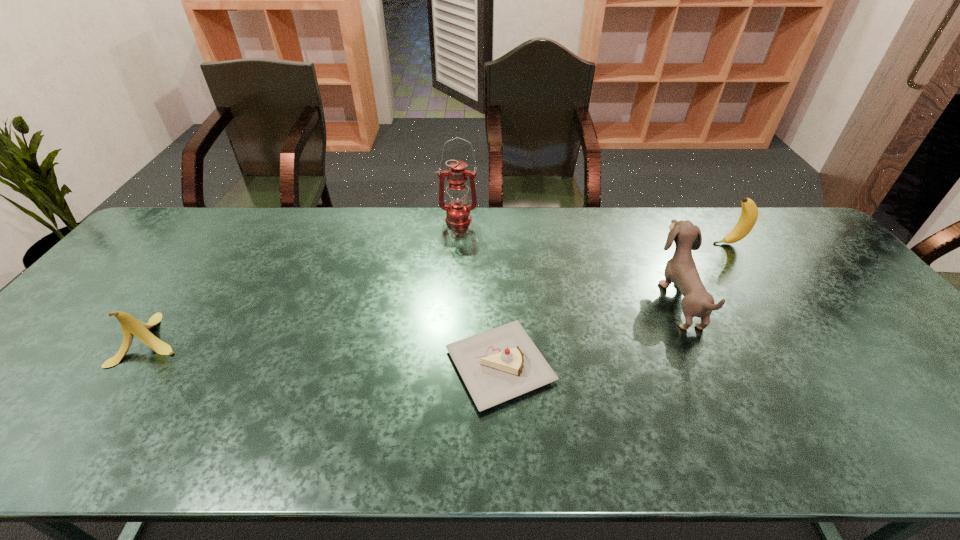
The width and height of the screenshot is (960, 540). I want to click on the farthest object, so click(458, 213).

I want to click on oil lamp, so click(458, 213).

In order to click on the fourth object from left to right in this screenshot , I will do `click(681, 269)`.

Find the location of a particular element. The height and width of the screenshot is (540, 960). the second farthest object is located at coordinates (749, 214).

This screenshot has height=540, width=960. I want to click on the taller banana, so click(749, 214).

Identify the location of the left banana. This screenshot has height=540, width=960. (130, 325).

Image resolution: width=960 pixels, height=540 pixels. I want to click on the second shortest object, so click(x=130, y=325).

Find the location of `cake`. cake is located at coordinates pos(497,365).

This screenshot has width=960, height=540. In order to click on free point located 0.360m on the right of the farthest object in this screenshot , I will do `click(582, 220)`.

You are a GUI agent. You are given a task and a screenshot of the screen. Output one action in this format:
    pyautogui.click(x=<x>, y=<y>)
    Task: Click on the vacant area situated at the face of the puppy
    The width and height of the screenshot is (960, 540).
    Given the screenshot: What is the action you would take?
    pyautogui.click(x=529, y=300)